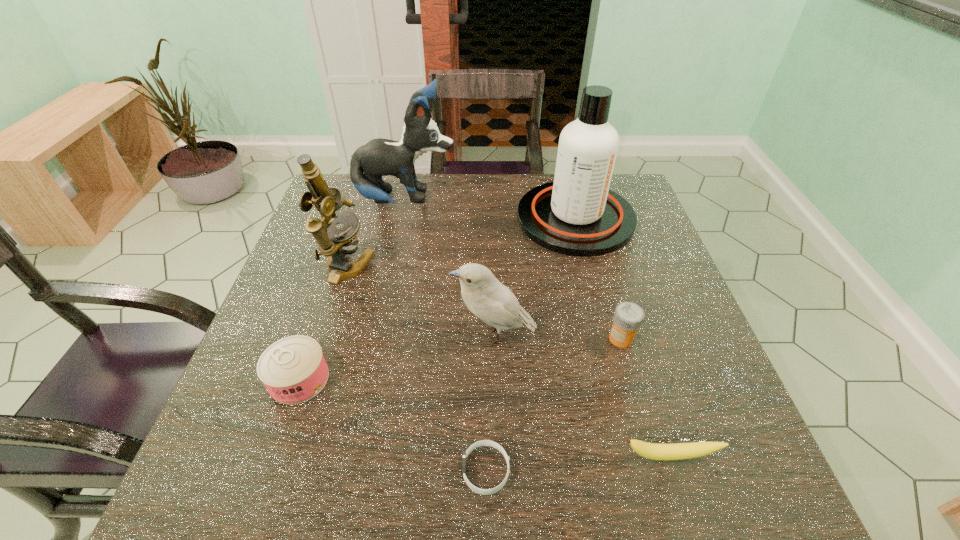
Find the location of a particular element. Image resolution: width=960 pixels, height=540 pixels. free space located 0.310m on the outer surface of the wristband is located at coordinates (276, 470).

Locate an element on the screen. vacant space located 0.300m on the outer surface of the wristband is located at coordinates (282, 470).

The height and width of the screenshot is (540, 960). What are the coordinates of `cleansing agent that is positioned at the far edge` in the screenshot? It's located at (577, 214).

Find the location of a particular element. Image resolution: width=960 pixels, height=540 pixels. puppy that is at the far edge is located at coordinates (379, 157).

Identify the location of banana that is positioned at the near edge. This screenshot has width=960, height=540. (661, 452).

Locate an element on the screen. The width and height of the screenshot is (960, 540). wristband that is at the near edge is located at coordinates (483, 442).

Where is `puppy present at the left edge`? puppy present at the left edge is located at coordinates (379, 157).

Locate an element on the screen. The height and width of the screenshot is (540, 960). microscope located at the left edge is located at coordinates (334, 243).

I want to click on can at the left edge, so click(293, 369).

The image size is (960, 540). In order to click on cleansing agent positioned at the right edge in this screenshot , I will do `click(577, 214)`.